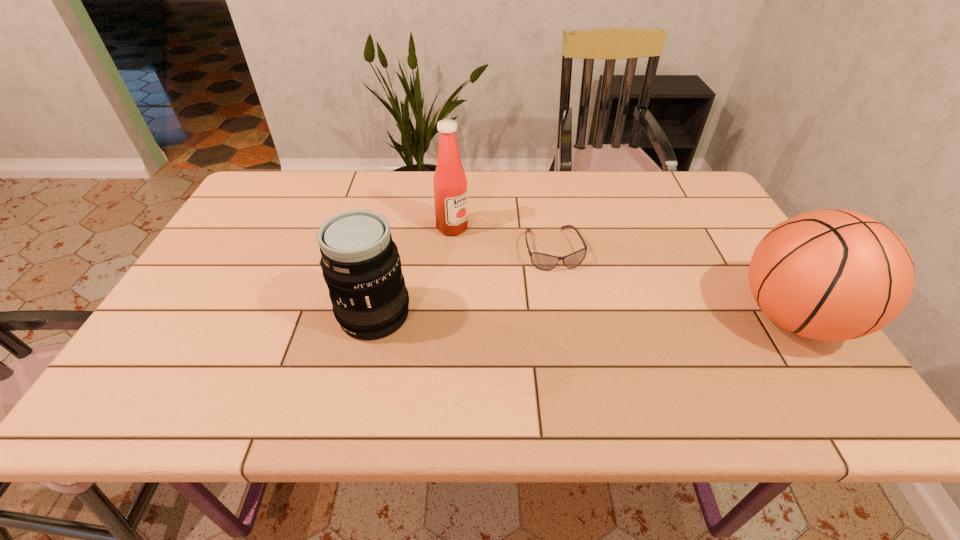
Select which object appears as the closest to the condiment. Please provide its 2D coordinates. Your answer should be formatted as a tuple, i.e. [(x, y)], where the tuple contains the x and y coordinates of a point satisfying the conditions above.

[(545, 262)]

Locate which object is the second closest to the sunglasses. Please provide its 2D coordinates. Your answer should be formatted as a tuple, i.e. [(x, y)], where the tuple contains the x and y coordinates of a point satisfying the conditions above.

[(361, 266)]

Where is `free region that satisfies the following two spatial constraints: 1. on the front side of the rightmost object; 2. on the right side of the leftmost object`? Image resolution: width=960 pixels, height=540 pixels. free region that satisfies the following two spatial constraints: 1. on the front side of the rightmost object; 2. on the right side of the leftmost object is located at coordinates (373, 318).

Where is `free point that satisfies the following two spatial constraints: 1. on the back side of the telephoto lens; 2. on the right side of the shortest object`? free point that satisfies the following two spatial constraints: 1. on the back side of the telephoto lens; 2. on the right side of the shortest object is located at coordinates (389, 249).

Where is `free location that satisfies the following two spatial constraints: 1. on the front side of the rightmost object; 2. on the right side of the sunglasses`? free location that satisfies the following two spatial constraints: 1. on the front side of the rightmost object; 2. on the right side of the sunglasses is located at coordinates (565, 318).